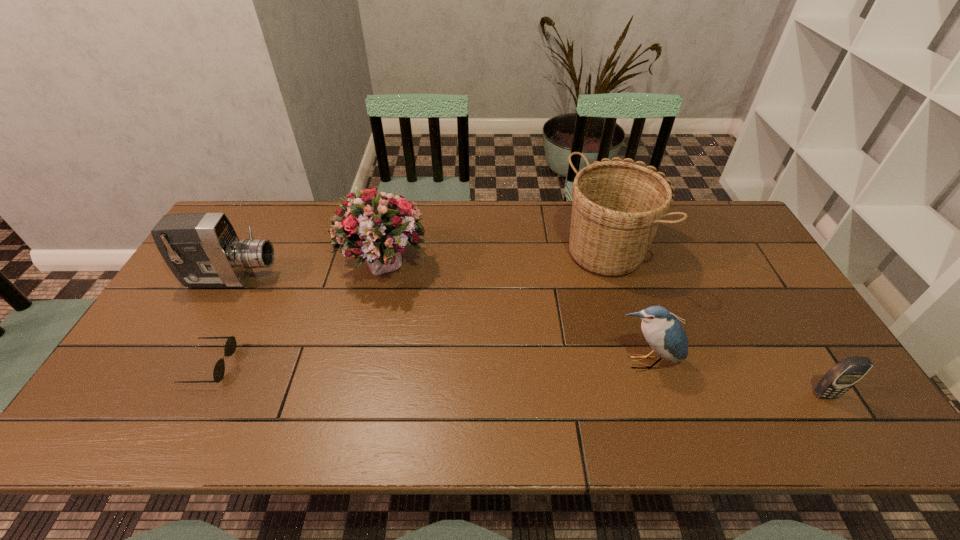
This screenshot has height=540, width=960. I want to click on basket, so click(x=617, y=207).

Locate an element on the screen. The image size is (960, 540). the third object from left to right is located at coordinates [x=377, y=226].

Find the location of a particular element. The height and width of the screenshot is (540, 960). camcorder is located at coordinates (202, 250).

The height and width of the screenshot is (540, 960). In order to click on bird in this screenshot , I will do `click(664, 333)`.

Locate an element on the screen. The height and width of the screenshot is (540, 960). the nearest object is located at coordinates (848, 371).

Where is `cellular telephone`? This screenshot has width=960, height=540. cellular telephone is located at coordinates click(x=848, y=371).

At what (x,y) coordinates should I click in order to perform the action: click on the shortest object. Please return your answer as a coordinate pair (x, y). Looking at the image, I should click on (230, 346).

You are a GUI agent. You are given a task and a screenshot of the screen. Output one action in this format:
    pyautogui.click(x=<x>, y=<y>)
    Task: Click on the vacant space located 0.310m on the left of the basket
    The image size is (960, 540).
    Given the screenshot: What is the action you would take?
    pyautogui.click(x=465, y=246)

Image resolution: width=960 pixels, height=540 pixels. I want to click on vacant region located 0.120m on the left of the bouquet, so click(300, 266).

Identify the location of free region located at the front of the camcorder, highlighting the lens. The image size is (960, 540). (294, 279).